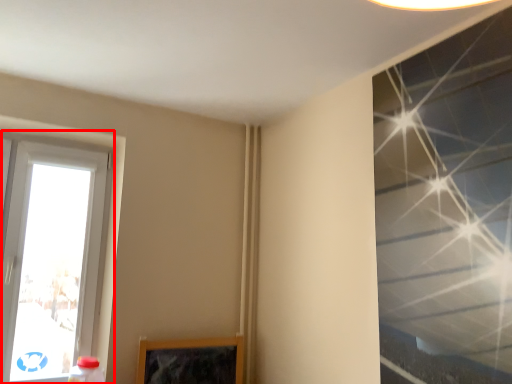
Question: From the image, what is the correct spatial relationship of window (annotated by the red box) in relation to window?

Choices:
 (A) left
 (B) right

Answer: (A)